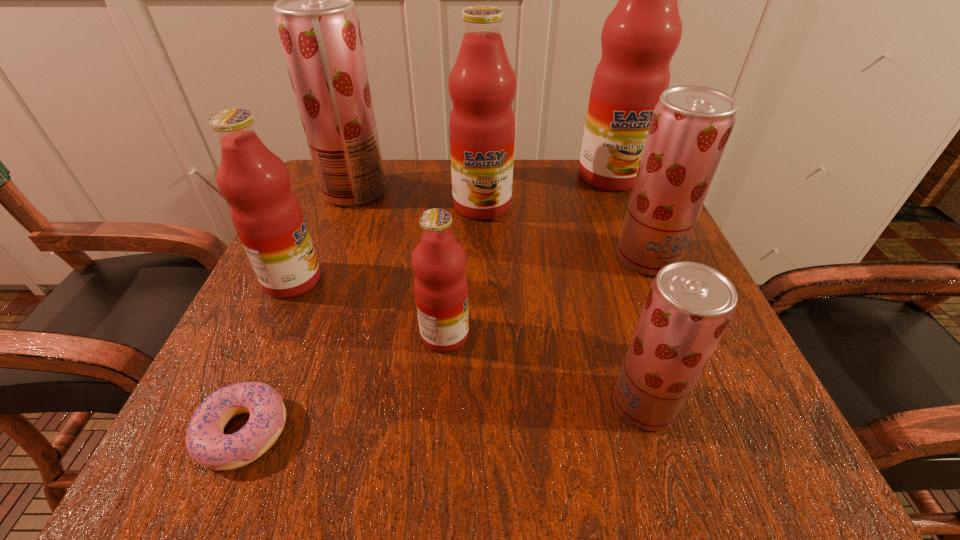
Identify the location of free space between the third smallest pink fruit juice and the biggest strawberry fruit juice. (419, 198).

Image resolution: width=960 pixels, height=540 pixels. I want to click on the second closest object relative to the leftmost pink fruit juice, so [x=206, y=443].

Identify the location of object that is the seventh closest to the second biggest strawberry fruit juice. Image resolution: width=960 pixels, height=540 pixels. (206, 443).

Select which fruit juice appears as the third closest to the leftmost strawberry fruit juice. Please provide its 2D coordinates. Your answer should be formatted as a tuple, i.e. [(x, y)], where the tuple contains the x and y coordinates of a point satisfying the conditions above.

[(440, 285)]

Point out which fruit juice is positioned as the fifth nearest to the third nearest object. Please provide its 2D coordinates. Your answer should be formatted as a tuple, i.e. [(x, y)], where the tuple contains the x and y coordinates of a point satisfying the conditions above.

[(318, 28)]

This screenshot has height=540, width=960. I want to click on the closest pink fruit juice to the nearest pink fruit juice, so click(267, 216).

Locate an element on the screen. Image resolution: width=960 pixels, height=540 pixels. pink fruit juice that is the nearest to the tallest fruit juice is located at coordinates (482, 84).

Identify which strawberry fruit juice is the second nearest to the smallest pink fruit juice. Please provide its 2D coordinates. Your answer should be formatted as a tuple, i.e. [(x, y)], where the tuple contains the x and y coordinates of a point satisfying the conditions above.

[(690, 127)]

Choose which strawberry fruit juice is the third nearest neighbor to the nearest pink fruit juice. Please provide its 2D coordinates. Your answer should be formatted as a tuple, i.e. [(x, y)], where the tuple contains the x and y coordinates of a point satisfying the conditions above.

[(318, 28)]

What are the coordinates of `vacant area that satisfies the following two spatial constraints: 1. on the label of the third nearest object; 2. on the back side of the nearest fruit juice` in the screenshot? It's located at (440, 404).